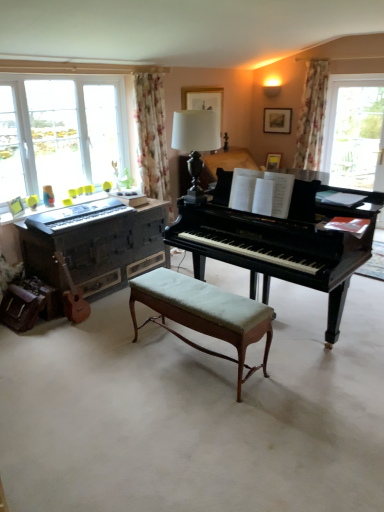
At what (x,y) coordinates should I click in order to perform the action: click on free space on the front side of black polished wood piano at center, acting as the first piano starting from the right. Please return your answer as a coordinate pair (x, y). Looking at the image, I should click on (259, 413).